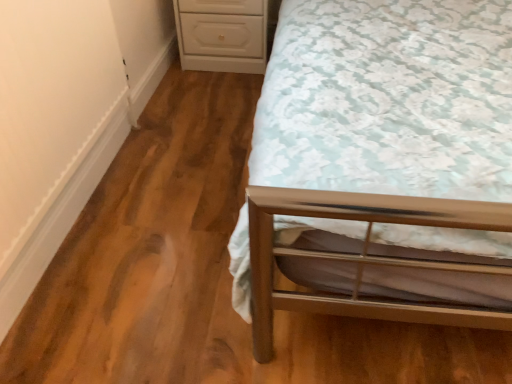
Question: From their relative heights in the image, would you say metallic silver bed at right is taller or shorter than white glossy chest of drawers at upper center?

Choices:
 (A) tall
 (B) short

Answer: (A)

Question: Does point (432, 137) appear closer or farther from the camera than point (224, 59)?

Choices:
 (A) closer
 (B) farther

Answer: (A)

Question: Is metallic silver bed at right situated inside white glossy chest of drawers at upper center or outside?

Choices:
 (A) inside
 (B) outside

Answer: (B)

Question: In terms of size, does white glossy chest of drawers at upper center appear bigger or smaller than metallic silver bed at right?

Choices:
 (A) small
 (B) big

Answer: (A)

Question: In terms of height, does white glossy chest of drawers at upper center look taller or shorter compared to metallic silver bed at right?

Choices:
 (A) tall
 (B) short

Answer: (B)

Question: From a real-world perspective, relative to metallic silver bed at right, is white glossy chest of drawers at upper center vertically above or below?

Choices:
 (A) below
 (B) above

Answer: (A)

Question: Considering the positions of white glossy chest of drawers at upper center and metallic silver bed at right in the image, is white glossy chest of drawers at upper center wider or thinner than metallic silver bed at right?

Choices:
 (A) wide
 (B) thin

Answer: (B)